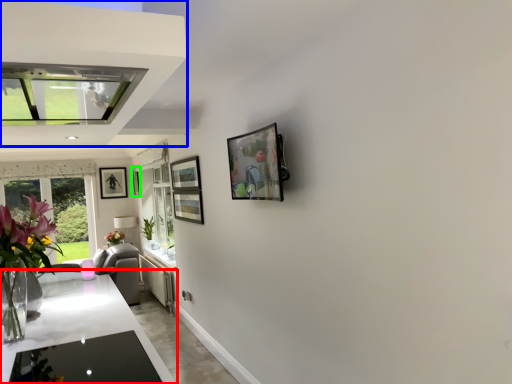
Question: Which is farther away from countertop (highlighted by a red box)? exhaust hood (highlighted by a blue box) or picture frame (highlighted by a green box)?

Choices:
 (A) exhaust hood
 (B) picture frame

Answer: (B)